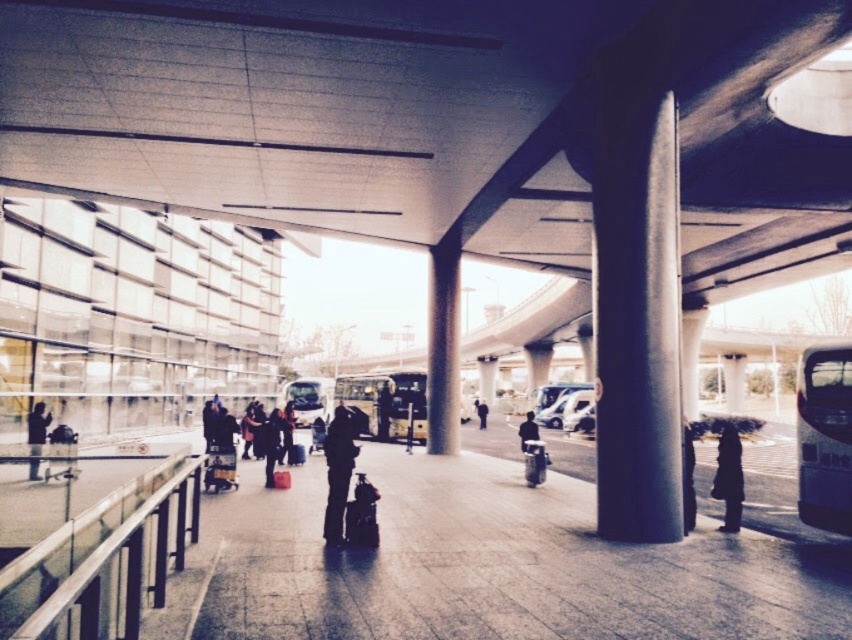
This screenshot has height=640, width=852. What do you see at coordinates (688, 477) in the screenshot?
I see `dark blue fabric coat at lower right` at bounding box center [688, 477].

Does point (691, 474) come in front of point (269, 428)?

Yes, it is in front of point (269, 428).

Image resolution: width=852 pixels, height=640 pixels. What are the coordinates of `dark blue fabric coat at lower right` in the screenshot? It's located at (688, 477).

Is gray concrete pillar at center smaller than dark blue fabric coat at lower right?

Indeed, gray concrete pillar at center has a smaller size compared to dark blue fabric coat at lower right.

Does gray concrete pillar at center lie behind dark blue fabric coat at lower right?

Yes, gray concrete pillar at center is further from the viewer.

Does point (430, 372) come farther from viewer compared to point (684, 492)?

Yes, point (430, 372) is farther from viewer.

Identify the location of gray concrete pillar at center. (442, 342).

How much distance is there between metallic silver bus at right and dark gray suit at left?

metallic silver bus at right and dark gray suit at left are 10.72 meters apart.

Find the location of `metallic silver bus at right`. metallic silver bus at right is located at coordinates pyautogui.click(x=824, y=436).